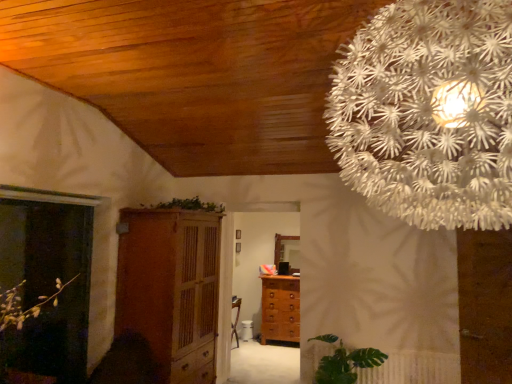
Where is `green leafy plant at lower right`? green leafy plant at lower right is located at coordinates (344, 362).

This screenshot has height=384, width=512. Describe the element at coordinates (280, 309) in the screenshot. I see `brown wooden chest of drawers at center` at that location.

Where is `white paper flower at upper right`? white paper flower at upper right is located at coordinates (428, 113).

Find the location of a particular element. translucent glass screen door at left is located at coordinates (47, 286).

Can you confirm if white paper flower at upper right is positioned to the left of wooden cabinet at center?

No.

From a real-world perspective, is white paper flower at upper right physically below wooden cabinet at center?

Actually, white paper flower at upper right is physically above wooden cabinet at center in the real world.

Which of these two, white paper flower at upper right or wooden cabinet at center, stands shorter?

→ white paper flower at upper right.

Is white paper flower at upper right not within wooden cabinet at center?

Absolutely, white paper flower at upper right is external to wooden cabinet at center.

Is green leafy plant at lower right closer to camera compared to brown wooden chest of drawers at center?

Yes, the depth of green leafy plant at lower right is less than that of brown wooden chest of drawers at center.

From the image's perspective, is green leafy plant at lower right located above or below brown wooden chest of drawers at center?

Based on their image positions, green leafy plant at lower right is located above brown wooden chest of drawers at center.

Which of these two, green leafy plant at lower right or brown wooden chest of drawers at center, is smaller?

Smaller between the two is green leafy plant at lower right.

From the image's perspective, is green leafy plant at upper center located above or below brown wooden chest of drawers at center?

From the image's perspective, green leafy plant at upper center appears above brown wooden chest of drawers at center.

Is green leafy plant at upper center facing towards brown wooden chest of drawers at center?

No, green leafy plant at upper center is not oriented towards brown wooden chest of drawers at center.

At what (x,y) coordinates should I click in order to perform the action: click on the chest of drawers located below the green leafy plant at upper center (from the image's perspective). Please return your answer as a coordinate pair (x, y). Looking at the image, I should click on (280, 309).

Considering the sizes of objects green leafy plant at upper center and brown wooden chest of drawers at center in the image provided, who is wider, green leafy plant at upper center or brown wooden chest of drawers at center?

With larger width is green leafy plant at upper center.

Between green leafy plant at lower right and translucent glass screen door at left, which one has larger size?

With larger size is green leafy plant at lower right.

Consider the image. Between green leafy plant at lower right and translucent glass screen door at left, which one appears on the right side from the viewer's perspective?

green leafy plant at lower right is more to the right.

This screenshot has width=512, height=384. I want to click on houseplant behind the translucent glass screen door at left, so click(344, 362).

How different are the orientations of green leafy plant at lower right and translucent glass screen door at left in degrees?

89.7 degrees.

Which of these two, white paper flower at upper right or brown wooden chest of drawers at center, is wider?

white paper flower at upper right.

Can you confirm if white paper flower at upper right is bigger than brown wooden chest of drawers at center?

Correct, white paper flower at upper right is larger in size than brown wooden chest of drawers at center.

Which of these two, white paper flower at upper right or brown wooden chest of drawers at center, stands taller?

white paper flower at upper right is taller.

Can you confirm if white paper flower at upper right is positioned to the left of brown wooden chest of drawers at center?

No.

Considering the relative positions of green leafy plant at upper center and green leafy plant at lower right in the image provided, is green leafy plant at upper center to the left of green leafy plant at lower right from the viewer's perspective?

Indeed, green leafy plant at upper center is positioned on the left side of green leafy plant at lower right.

From the image's perspective, between green leafy plant at upper center and green leafy plant at lower right, which one is located above?

green leafy plant at upper center.

Is green leafy plant at upper center far away from green leafy plant at lower right?

Absolutely, green leafy plant at upper center is distant from green leafy plant at lower right.

Between green leafy plant at upper center and green leafy plant at lower right, which one has less height?

green leafy plant at upper center is shorter.

Which object is further away from the camera, brown wooden chest of drawers at center or wooden cabinet at center?

brown wooden chest of drawers at center.

Between brown wooden chest of drawers at center and wooden cabinet at center, which one has smaller width?

brown wooden chest of drawers at center.

Looking at this image, which of these two, brown wooden chest of drawers at center or wooden cabinet at center, is smaller?

brown wooden chest of drawers at center is smaller.

Which is closer to the camera, (298, 332) or (203, 326)?

Clearly, point (298, 332) is more distant from the camera than point (203, 326).

Find the location of `flower positioned vertically above the wooden cabinet at center (from a real-world perspective)`. flower positioned vertically above the wooden cabinet at center (from a real-world perspective) is located at coordinates (428, 113).

Find the location of a particular element. This screenshot has width=512, height=384. the chest of drawers lying behind the green leafy plant at lower right is located at coordinates 280,309.

Estimate the real-world distances between objects in this image. Which object is further from translucent glass screen door at left, wooden cabinet at center or green leafy plant at upper center?

Among the two, green leafy plant at upper center is located further to translucent glass screen door at left.

Looking at the image, which one is located further to white paper flower at upper right, translucent glass screen door at left or brown wooden chest of drawers at center?

brown wooden chest of drawers at center.

Looking at the image, which one is located closer to green leafy plant at upper center, brown wooden chest of drawers at center or translucent glass screen door at left?

translucent glass screen door at left.

Which object lies further to the anchor point green leafy plant at lower right, brown wooden chest of drawers at center or green leafy plant at upper center?

green leafy plant at upper center.

Looking at the image, which one is located closer to translucent glass screen door at left, brown wooden chest of drawers at center or green leafy plant at upper center?

green leafy plant at upper center is closer to translucent glass screen door at left.

Consider the image. When comparing their distances from green leafy plant at lower right, does green leafy plant at upper center or brown wooden chest of drawers at center seem further?

The object further to green leafy plant at lower right is green leafy plant at upper center.

In the scene shown: From the image, which object appears to be nearer to translucent glass screen door at left, white paper flower at upper right or green leafy plant at upper center?

green leafy plant at upper center.

Considering their positions, is white paper flower at upper right positioned further to green leafy plant at upper center than translucent glass screen door at left?

white paper flower at upper right.

At what (x,y) coordinates should I click in order to perform the action: click on plant positioned between white paper flower at upper right and brown wooden chest of drawers at center from near to far. Please return your answer as a coordinate pair (x, y). Image resolution: width=512 pixels, height=384 pixels. Looking at the image, I should click on (188, 205).

Identify the location of cupboard positioned between white paper flower at upper right and brown wooden chest of drawers at center from near to far. (170, 288).

Locate an element on the screen. This screenshot has height=384, width=512. plant located between wooden cabinet at center and green leafy plant at lower right in the left-right direction is located at coordinates 188,205.

Find the location of a particular element. cupboard between white paper flower at upper right and green leafy plant at upper center along the z-axis is located at coordinates (170, 288).